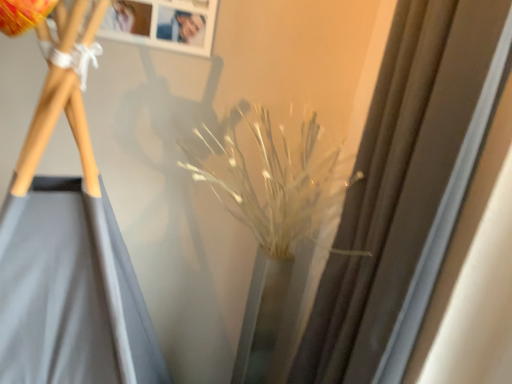
Where is `translucent fabric curtain at right`? translucent fabric curtain at right is located at coordinates (405, 188).

The height and width of the screenshot is (384, 512). What do you see at coordinates (405, 188) in the screenshot?
I see `translucent fabric curtain at right` at bounding box center [405, 188].

The height and width of the screenshot is (384, 512). I want to click on translucent fabric curtain at right, so click(x=405, y=188).